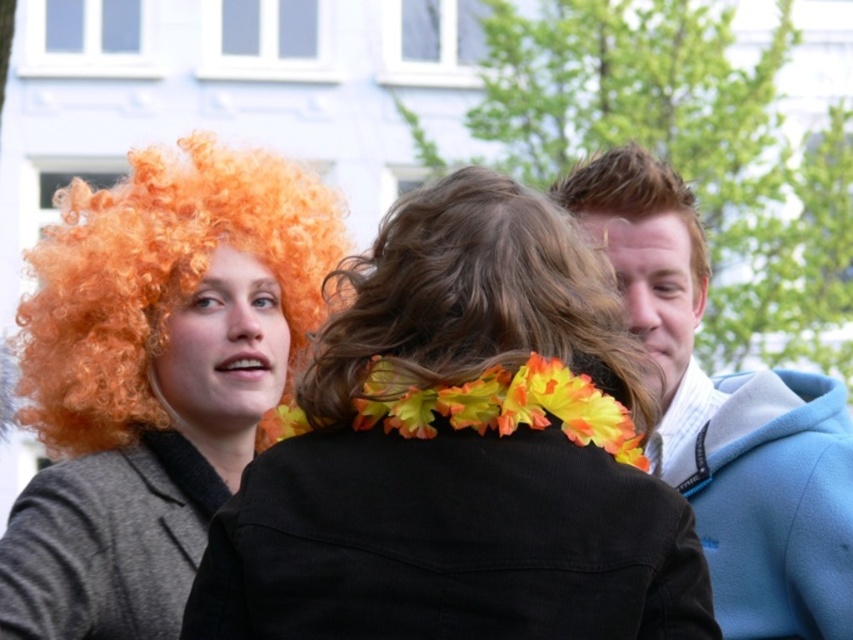
Question: Where is light blue fleece jacket at right located in relation to dark brown curly hair at center in the image?

Choices:
 (A) right
 (B) left

Answer: (A)

Question: Estimate the real-world distances between objects in this image. Which object is farther from the curly orange wig at left?

Choices:
 (A) slick brown hair at upper right
 (B) dark brown curly hair at center
 (C) orange curly wig at left

Answer: (A)

Question: Which object is farther from the camera taking this photo?

Choices:
 (A) dark brown curly hair at center
 (B) light blue fleece jacket at right
 (C) slick brown hair at upper right

Answer: (C)

Question: Estimate the real-world distances between objects in this image. Which object is closer to the orange curly wig at left?

Choices:
 (A) dark brown curly hair at center
 (B) slick brown hair at upper right

Answer: (B)

Question: Does curly orange wig at left appear under slick brown hair at upper right?

Choices:
 (A) yes
 (B) no

Answer: (A)

Question: Does orange curly wig at left appear over dark brown curly hair at center?

Choices:
 (A) no
 (B) yes

Answer: (B)